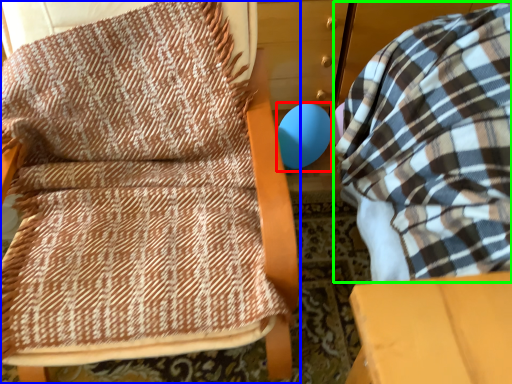
Question: Which object is positioned farthest from balloon (highlighted by a red box)? Select from furniture (highlighted by a blue box) and bean bag chair (highlighted by a green box).

Choices:
 (A) furniture
 (B) bean bag chair

Answer: (A)